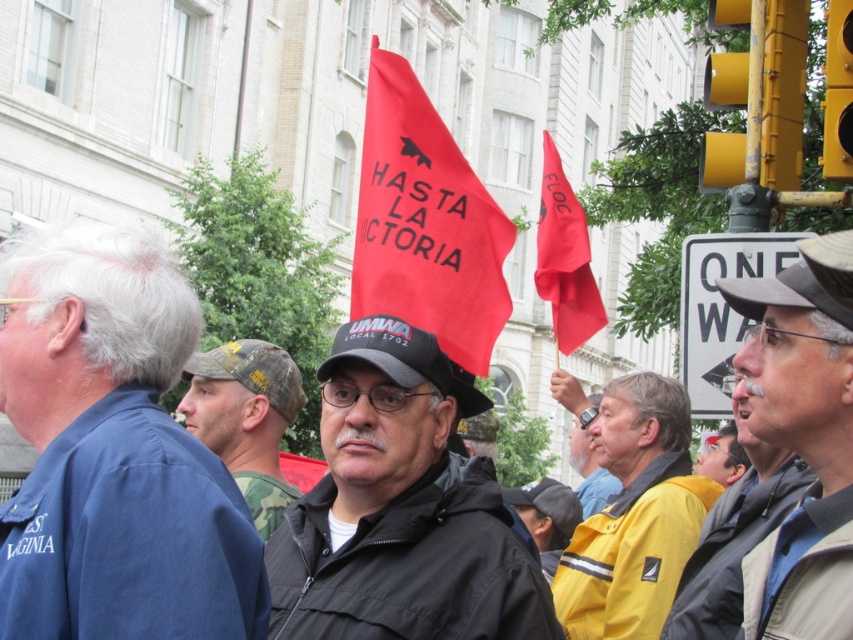
Question: Which object is the closest to the yellow fabric jacket at center?

Choices:
 (A) yellow fabric at center
 (B) red fabric flag at center

Answer: (A)

Question: Which of the following is the closest to the observer?

Choices:
 (A) (827, 550)
 (B) (743, 246)
 (C) (83, 296)

Answer: (A)

Question: Does blue fabric shirt at left have a greater width compared to red fabric flag at center?

Choices:
 (A) no
 (B) yes

Answer: (B)

Question: Does black matte cap at center have a larger size compared to gray fabric cap at upper center?

Choices:
 (A) no
 (B) yes

Answer: (B)

Question: Is yellow jacket at center positioned at the back of yellow fabric at center?

Choices:
 (A) yes
 (B) no

Answer: (B)

Question: Among these objects, which one is nearest to the camera?

Choices:
 (A) matte black cap at center
 (B) black matte cap at center
 (C) white plastic sign at upper right
 (D) yellow fabric at center

Answer: (B)